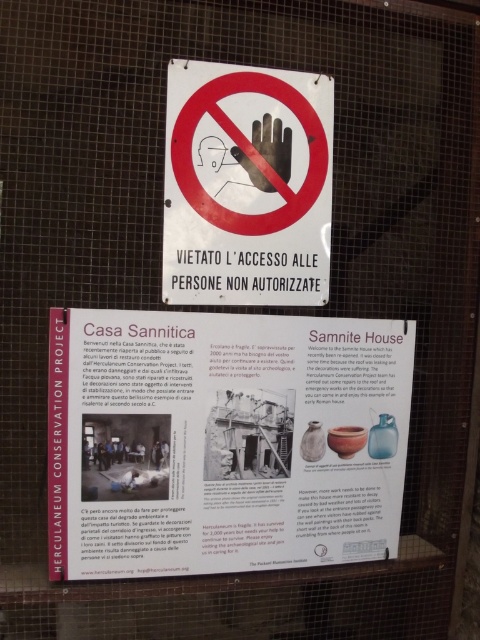
Does white paper at center appear over matte white sign at center?

Actually, white paper at center is below matte white sign at center.

Is white paper at center to the left of matte white sign at center from the viewer's perspective?

Correct, you'll find white paper at center to the left of matte white sign at center.

Between point (294, 474) and point (263, 128), which one is positioned behind?

The point (294, 474) is behind.

Find the location of a particular element. The width and height of the screenshot is (480, 640). white paper at center is located at coordinates (224, 442).